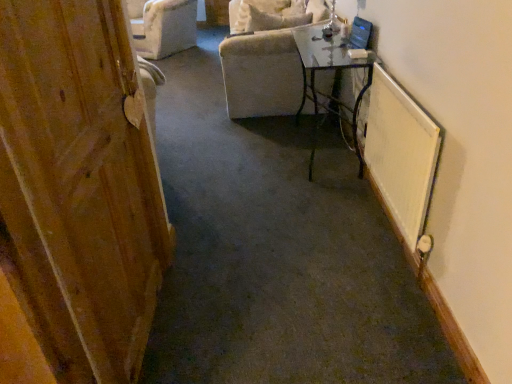
At what (x,y) coordinates should I click in order to perform the action: click on wooden door at left. Please return your answer as a coordinate pair (x, y). This screenshot has height=384, width=512. Looking at the image, I should click on (76, 195).

You are a GUI agent. You are given a task and a screenshot of the screen. Output one action in this format:
    pyautogui.click(x=<x>, y=<y>)
    Task: Click on the white textured radiator at right
    Image resolution: width=512 pixels, height=384 pixels.
    Given the screenshot: What is the action you would take?
    tap(400, 153)

What is the approximate height of velvet beige armchair at upper center?

velvet beige armchair at upper center is 25.04 inches in height.

At what (x,y) coordinates should I click in order to perform the action: click on wooden door at left. Please return your answer as a coordinate pair (x, y). Looking at the image, I should click on tap(76, 195).

Based on the photo, does velvet beige armchair at upper center appear on the right side of clear glass table at center?

No.

The height and width of the screenshot is (384, 512). I want to click on table below the velvet beige armchair at upper center (from a real-world perspective), so [x=331, y=69].

Is there a large distance between velvet beige armchair at upper center and clear glass table at center?

No, velvet beige armchair at upper center is in close proximity to clear glass table at center.

Is velvet beige armchair at upper center located outside clear glass table at center?

Yes, velvet beige armchair at upper center is located beyond the bounds of clear glass table at center.

Based on the photo, is clear glass table at center to the left of white textured radiator at right from the viewer's perspective?

Correct, you'll find clear glass table at center to the left of white textured radiator at right.

Can you confirm if clear glass table at center is smaller than white textured radiator at right?

No.

Is white textured radiator at right at the back of clear glass table at center?

No, clear glass table at center is not facing away from white textured radiator at right.

From the image's perspective, is clear glass table at center located beneath velvet beige armchair at upper center?

Yes.

Is point (353, 37) positioned behind point (269, 28)?

No, it is not.

Between clear glass table at center and velvet beige armchair at upper center, which one appears on the left side from the viewer's perspective?

velvet beige armchair at upper center is more to the left.

In the scene shown: Can you tell me how much velvet beige armchair at upper center and wooden door at left differ in facing direction?

They differ by 104 degrees in their facing directions.

Is wooden door at left located within velvet beige armchair at upper center?

No, wooden door at left is not surrounded by velvet beige armchair at upper center.

Is velvet beige armchair at upper center next to wooden door at left and touching it?

No, velvet beige armchair at upper center is not touching wooden door at left.

From the picture: From a real-world perspective, is velvet beige armchair at upper center located beneath wooden door at left?

Indeed, from a real-world perspective, velvet beige armchair at upper center is positioned beneath wooden door at left.

Is clear glass table at center completely or partially outside of wooden door at left?

Yes, clear glass table at center is not within wooden door at left.

Consider the image. In terms of height, does clear glass table at center look taller or shorter compared to wooden door at left?

Clearly, clear glass table at center is shorter compared to wooden door at left.

From the picture: Which object is wider, clear glass table at center or wooden door at left?

clear glass table at center.

Find the location of a particular element. This screenshot has width=512, height=384. table below the wooden door at left (from a real-world perspective) is located at coordinates (331, 69).

From the image's perspective, is wooden door at left on top of clear glass table at center?

Incorrect, from the image's perspective, wooden door at left is lower than clear glass table at center.

Based on the photo, would you say wooden door at left is outside clear glass table at center?

Yes, wooden door at left is outside of clear glass table at center.

You are a GUI agent. You are given a task and a screenshot of the screen. Output one action in this format:
    pyautogui.click(x=<x>, y=<y>)
    Task: Click on the door above the clear glass table at center (from a real-world perspective)
    
    Given the screenshot: What is the action you would take?
    pyautogui.click(x=76, y=195)

Is wooden door at left to the left of clear glass table at center from the viewer's perspective?

Yes.

Considering the sizes of objects white textured radiator at right and wooden door at left in the image provided, who is shorter, white textured radiator at right or wooden door at left?

white textured radiator at right.

Is white textured radiator at right thinner than wooden door at left?

No.

From a real-world perspective, is white textured radiator at right located higher than wooden door at left?

No, from a real-world perspective, white textured radiator at right is not over wooden door at left

Is there a large distance between white textured radiator at right and wooden door at left?

Yes, white textured radiator at right and wooden door at left are quite far apart.

Find the location of a particular element. The height and width of the screenshot is (384, 512). chair that appears on the left of clear glass table at center is located at coordinates point(264,59).

Identify the location of table lying above the white textured radiator at right (from the image's perspective). The height and width of the screenshot is (384, 512). tap(331, 69).

Estimate the real-world distances between objects in this image. Which object is closer to clear glass table at center, white textured radiator at right or velvet beige armchair at upper center?

Among the two, velvet beige armchair at upper center is located nearer to clear glass table at center.

From the image, which object appears to be farther from white textured radiator at right, clear glass table at center or wooden door at left?

wooden door at left is further to white textured radiator at right.

From the image, which object appears to be nearer to clear glass table at center, wooden door at left or velvet beige armchair at upper center?

Based on the image, velvet beige armchair at upper center appears to be nearer to clear glass table at center.

Looking at the image, which one is located further to velvet beige armchair at upper center, white textured radiator at right or wooden door at left?

wooden door at left is positioned further to the anchor velvet beige armchair at upper center.

From the image, which object appears to be nearer to clear glass table at center, wooden door at left or white textured radiator at right?

Based on the image, white textured radiator at right appears to be nearer to clear glass table at center.

From the image, which object appears to be farther from velvet beige armchair at upper center, clear glass table at center or wooden door at left?

wooden door at left is further to velvet beige armchair at upper center.

Estimate the real-world distances between objects in this image. Which object is further from velvet beige armchair at upper center, clear glass table at center or white textured radiator at right?

The object further to velvet beige armchair at upper center is white textured radiator at right.

Looking at the image, which one is located further to clear glass table at center, velvet beige armchair at upper center or wooden door at left?

wooden door at left lies further to clear glass table at center than the other object.

Where is `table positioned between white textured radiator at right and velvet beige armchair at upper center from near to far`? The height and width of the screenshot is (384, 512). table positioned between white textured radiator at right and velvet beige armchair at upper center from near to far is located at coordinates (331, 69).

You are a GUI agent. You are given a task and a screenshot of the screen. Output one action in this format:
    pyautogui.click(x=<x>, y=<y>)
    Task: Click on the radiator between wooden door at left and velvet beige armchair at upper center in the front-back direction
    
    Given the screenshot: What is the action you would take?
    pyautogui.click(x=400, y=153)

Image resolution: width=512 pixels, height=384 pixels. I want to click on radiator between wooden door at left and clear glass table at center in the front-back direction, so click(x=400, y=153).

At what (x,y) coordinates should I click in order to perform the action: click on table between wooden door at left and velvet beige armchair at upper center along the z-axis. Please return your answer as a coordinate pair (x, y). Looking at the image, I should click on (331, 69).